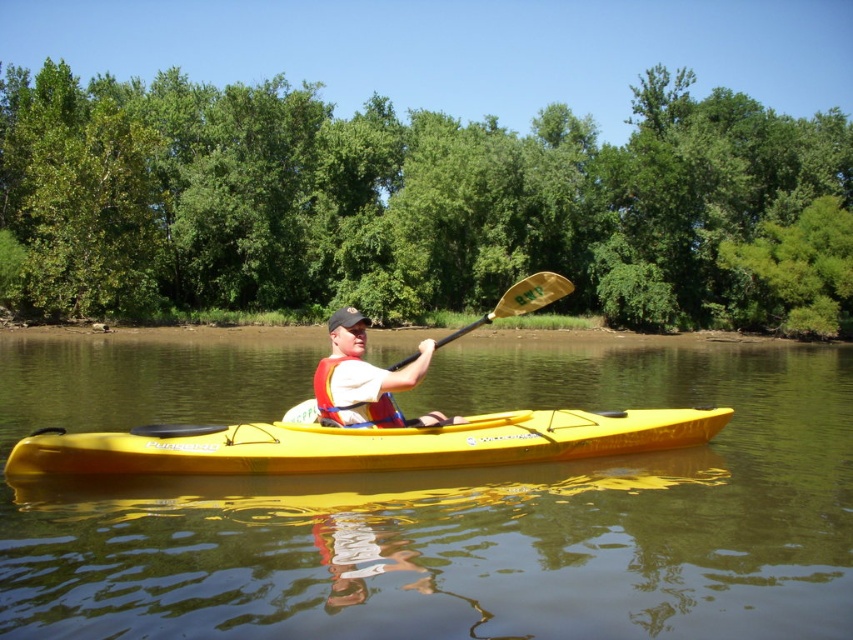
Who is positioned more to the left, wooden textured paddle at center or red life jacket at center?

red life jacket at center

Does point (555, 280) come in front of point (323, 380)?

No, (555, 280) is behind (323, 380).

Locate an element on the screen. Image resolution: width=853 pixels, height=640 pixels. wooden textured paddle at center is located at coordinates (519, 300).

Is yellow matte kayak at center below matte white life vest at center?

Yes.

Is yellow matte kayak at center smaller than matte white life vest at center?

Correct, yellow matte kayak at center occupies less space than matte white life vest at center.

I want to click on yellow matte kayak at center, so click(361, 444).

Which of these two, matte white life vest at center or red life jacket at center, stands shorter?

red life jacket at center

Is point (323, 364) behind point (332, 417)?

No.

The height and width of the screenshot is (640, 853). What are the coordinates of `matte white life vest at center` in the screenshot? It's located at (366, 380).